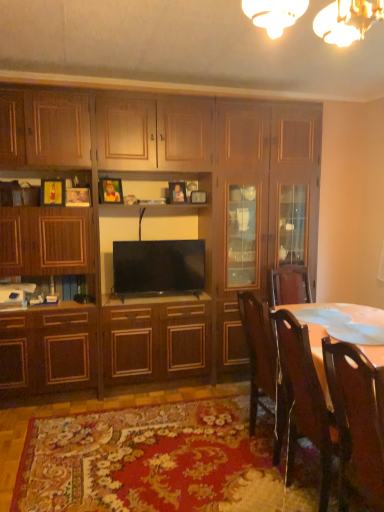
Question: Is the depth of wooden cabinet at center greater than that of flat screen tv at center?

Choices:
 (A) no
 (B) yes

Answer: (A)

Question: Is flat screen tv at center at the back of wooden cabinet at center?

Choices:
 (A) yes
 (B) no

Answer: (A)

Question: Can you confirm if wooden cabinet at center is positioned to the right of flat screen tv at center?

Choices:
 (A) yes
 (B) no

Answer: (A)

Question: Is wooden cabinet at center positioned beyond the bounds of flat screen tv at center?

Choices:
 (A) yes
 (B) no

Answer: (A)

Question: From the image's perspective, is wooden cabinet at center below flat screen tv at center?

Choices:
 (A) no
 (B) yes

Answer: (A)

Question: Does point tap(115, 251) appear closer or farther from the camera than point tap(23, 137)?

Choices:
 (A) closer
 (B) farther

Answer: (B)

Question: From the image's perspective, is flat screen tv at center above or below wooden cabinet at center?

Choices:
 (A) below
 (B) above

Answer: (A)

Question: Looking at the image, does flat screen tv at center seem bigger or smaller compared to wooden cabinet at center?

Choices:
 (A) small
 (B) big

Answer: (A)

Question: In the image, is flat screen tv at center on the left side or the right side of wooden cabinet at center?

Choices:
 (A) left
 (B) right

Answer: (A)

Question: Is wooden chair at right, which appears as the second chair when viewed from the back, in front of or behind wooden chair at lower right, the second chair when ordered from front to back, in the image?

Choices:
 (A) behind
 (B) front

Answer: (B)

Question: Based on their positions, is wooden chair at right, which appears as the second chair when viewed from the back, located to the left or right of wooden chair at lower right, placed as the 1th chair when sorted from back to front?

Choices:
 (A) right
 (B) left

Answer: (A)

Question: Is point (364, 354) positioned closer to the camera than point (296, 346)?

Choices:
 (A) closer
 (B) farther

Answer: (A)

Question: Based on their sizes in the image, would you say wooden chair at right, which appears as the second chair when viewed from the back, is bigger or smaller than wooden chair at lower right, the second chair when ordered from front to back?

Choices:
 (A) big
 (B) small

Answer: (B)

Question: From the image's perspective, is wooden chair at right, which appears as the second chair when viewed from the back, located above or below flat screen tv at center?

Choices:
 (A) above
 (B) below

Answer: (B)

Question: Is point (382, 442) positioned closer to the camera than point (155, 247)?

Choices:
 (A) closer
 (B) farther

Answer: (A)